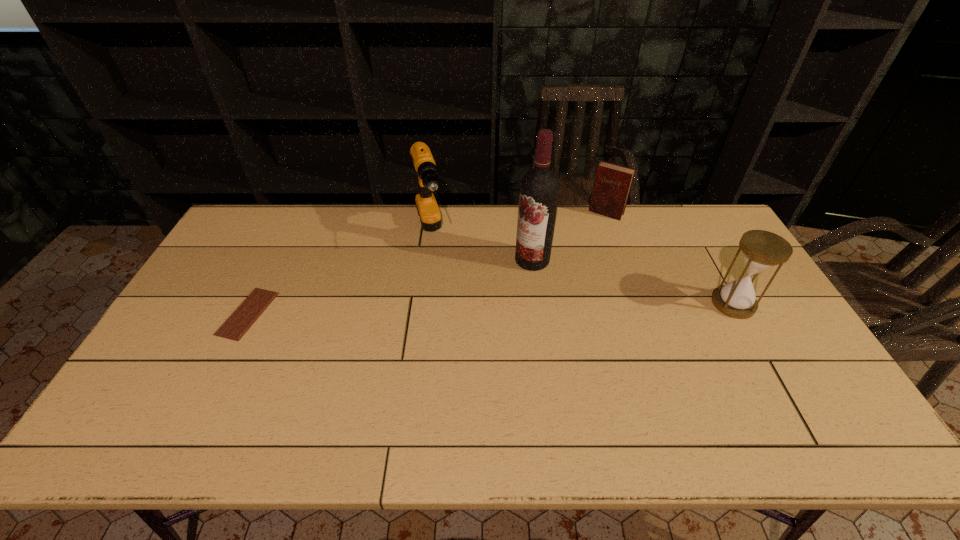
Where is `the shortest object`? The height and width of the screenshot is (540, 960). the shortest object is located at coordinates (234, 328).

At what (x,y) coordinates should I click in order to perform the action: click on the leftmost object. Please return your answer as a coordinate pair (x, y). Looking at the image, I should click on (234, 328).

You are a GUI agent. You are given a task and a screenshot of the screen. Output one action in this format:
    pyautogui.click(x=<x>, y=<y>)
    Task: Click on the rightmost object
    The image size is (960, 540).
    Given the screenshot: What is the action you would take?
    pyautogui.click(x=761, y=250)

What are the coordinates of `the third tallest object` in the screenshot? It's located at (761, 250).

Locate an element on the screen. The width and height of the screenshot is (960, 540). wine bottle is located at coordinates (539, 189).

The width and height of the screenshot is (960, 540). What are the coordinates of `the third object from right to left` in the screenshot? It's located at (539, 189).

Where is `drill`? This screenshot has width=960, height=540. drill is located at coordinates (428, 180).

Identify the location of the second tallest object. The width and height of the screenshot is (960, 540). (428, 180).

Find the location of `the fourth object from left to right`. the fourth object from left to right is located at coordinates (612, 184).

Locate an element on the screen. diary is located at coordinates (612, 184).